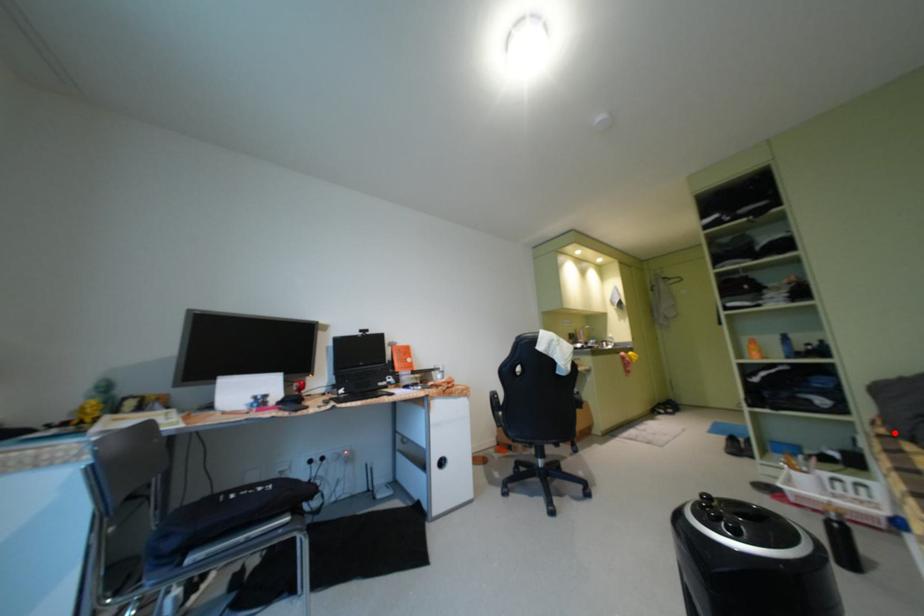
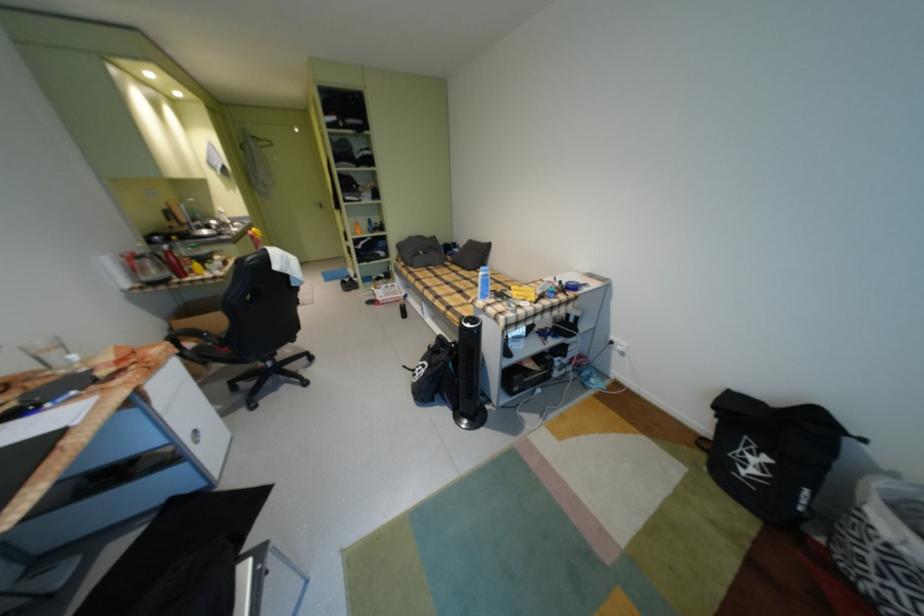
Question: I am providing you with two images of the same scene from different viewpoints. Given a red point in image1, look at the same physical point in image2. Is it:

Choices:
 (A) Closer to the viewpoint
 (B) Farther from the viewpoint

Answer: (A)